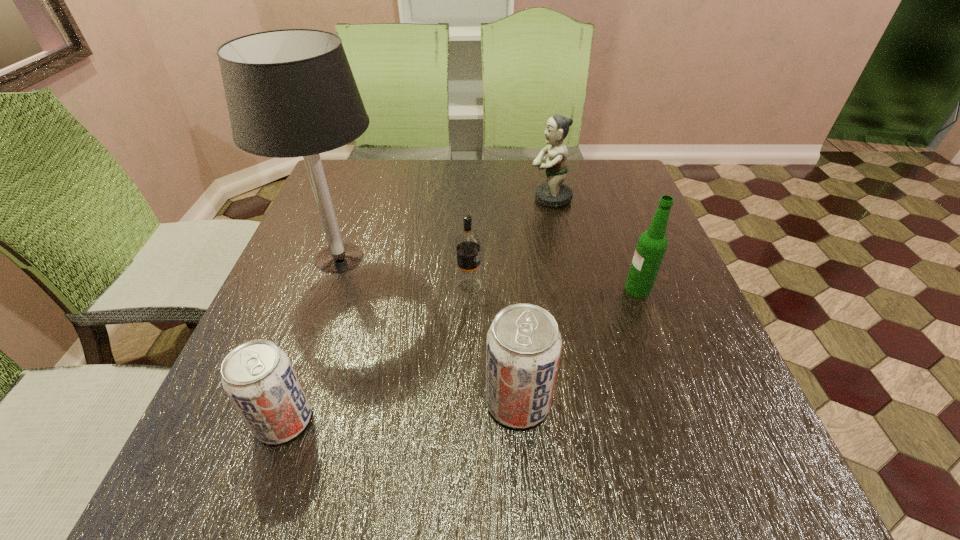
Identify the location of vacant space positioned on the front-facing side of the figurine. (512, 198).

The width and height of the screenshot is (960, 540). I want to click on free space located 0.220m on the front-facing side of the figurine, so click(450, 198).

Locate an element on the screen. vacant space located 0.050m on the front-facing side of the figurine is located at coordinates (512, 198).

Image resolution: width=960 pixels, height=540 pixels. Find the location of `free space located 0.150m on the label of the third object from left to right`. free space located 0.150m on the label of the third object from left to right is located at coordinates (550, 286).

At what (x,y) coordinates should I click in order to perform the action: click on vacant space located on the front of the table lamp. Please return your answer as a coordinate pair (x, y). The height and width of the screenshot is (540, 960). Looking at the image, I should click on (282, 417).

You are a GUI agent. You are given a task and a screenshot of the screen. Output one action in this format:
    pyautogui.click(x=<x>, y=<y>)
    Task: Click on the free space located 0.130m on the label of the beer bottle
    This screenshot has width=960, height=540.
    Given the screenshot: What is the action you would take?
    pyautogui.click(x=565, y=289)

Locate an element on the screen. This screenshot has height=540, width=960. vacant space located on the label of the beer bottle is located at coordinates (465, 289).

Image resolution: width=960 pixels, height=540 pixels. Find the location of `vacant space located 0.150m on the label of the beer bottle`. vacant space located 0.150m on the label of the beer bottle is located at coordinates (556, 289).

Identify the location of object at the far edge. (554, 193).

Image resolution: width=960 pixels, height=540 pixels. Identify the location of soda can situated at the left edge. (257, 376).